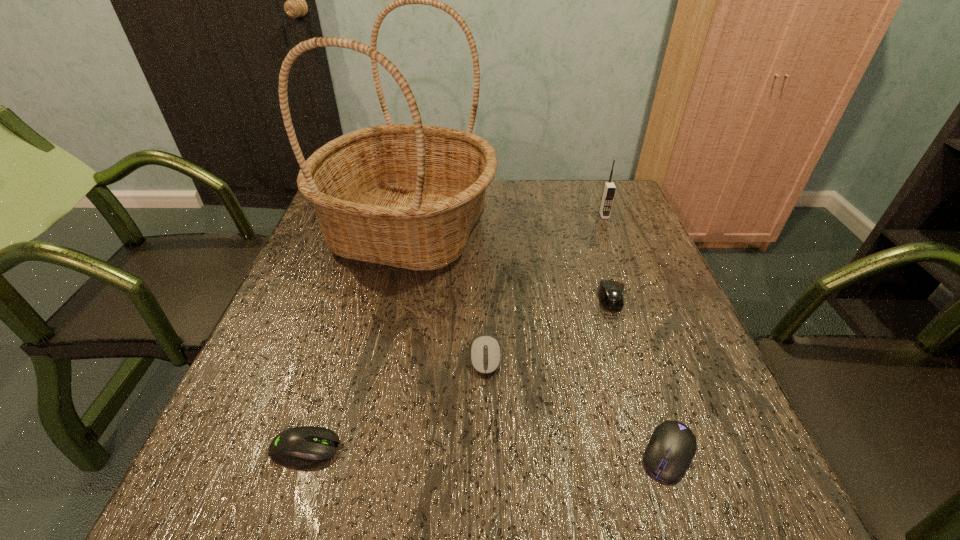
Locate an element on the screen. The width and height of the screenshot is (960, 540). vacant space located 0.050m on the wheel side of the leftmost computer mouse is located at coordinates (371, 448).

Identify the location of basket present at the far edge. (404, 195).

What are the coordinates of `cellular telephone situated at the far edge` in the screenshot? It's located at (609, 189).

At what (x,y) coordinates should I click in order to perform the action: click on basket located at the left edge. Please return your answer as a coordinate pair (x, y). The width and height of the screenshot is (960, 540). Looking at the image, I should click on (404, 195).

Where is `computer mouse located at the left edge`? computer mouse located at the left edge is located at coordinates (307, 445).

This screenshot has height=540, width=960. In order to click on cellular telephone at the right edge in this screenshot , I will do `click(609, 189)`.

At what (x,y) coordinates should I click in order to perform the action: click on object at the far left corner. Please return your answer as a coordinate pair (x, y). Image resolution: width=960 pixels, height=540 pixels. Looking at the image, I should click on (404, 195).

Image resolution: width=960 pixels, height=540 pixels. Find the location of `object that is at the near left corner`. object that is at the near left corner is located at coordinates (307, 445).

You are a GUI agent. You are given a task and a screenshot of the screen. Output one action in this format:
    pyautogui.click(x=<x>, y=<y>)
    Task: Click on the object that is at the far right corner
    Image resolution: width=960 pixels, height=540 pixels.
    Given the screenshot: What is the action you would take?
    pyautogui.click(x=609, y=189)

At what (x,y) coordinates should I click in order to perform the action: click on object at the near right corner. Please return your answer as a coordinate pair (x, y). Looking at the image, I should click on (672, 446).